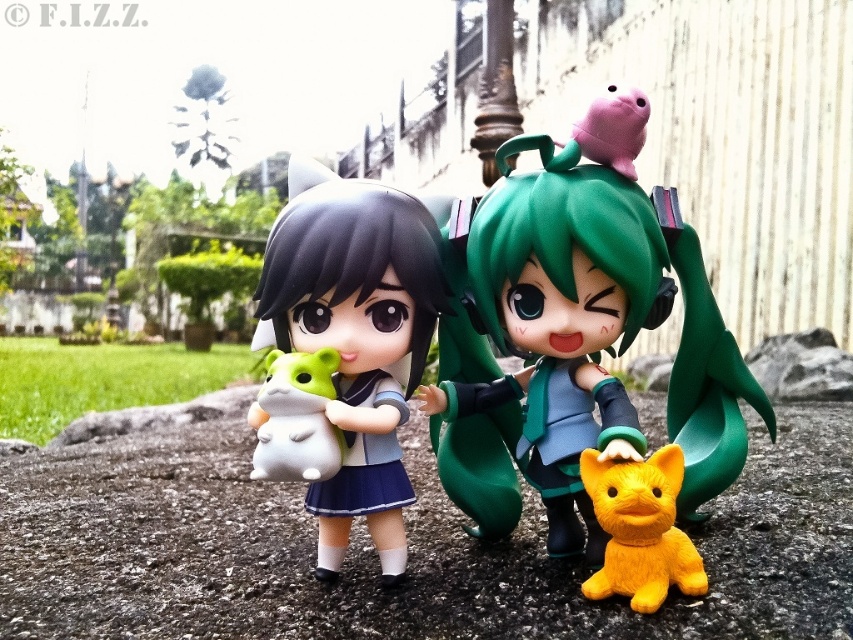
Question: Which is farther from the satin white plush at center?

Choices:
 (A) green matte doll at center
 (B) white matte plush toy at left

Answer: (A)

Question: Which object appears closest to the camera in this image?

Choices:
 (A) satin white plush at center
 (B) green matte doll at center

Answer: (B)

Question: Which object is positioned farthest from the green matte doll at center?

Choices:
 (A) satin white plush at center
 (B) yellow rubber cat at lower right

Answer: (B)

Question: Where is satin white plush at center located in relation to yellow rubber cat at lower right in the image?

Choices:
 (A) above
 (B) below

Answer: (A)

Question: Can you confirm if yellow rubber cat at lower right is smaller than white matte plush toy at left?

Choices:
 (A) yes
 (B) no

Answer: (B)

Question: Can you confirm if yellow rubber cat at lower right is positioned to the left of white matte plush toy at left?

Choices:
 (A) no
 (B) yes

Answer: (A)